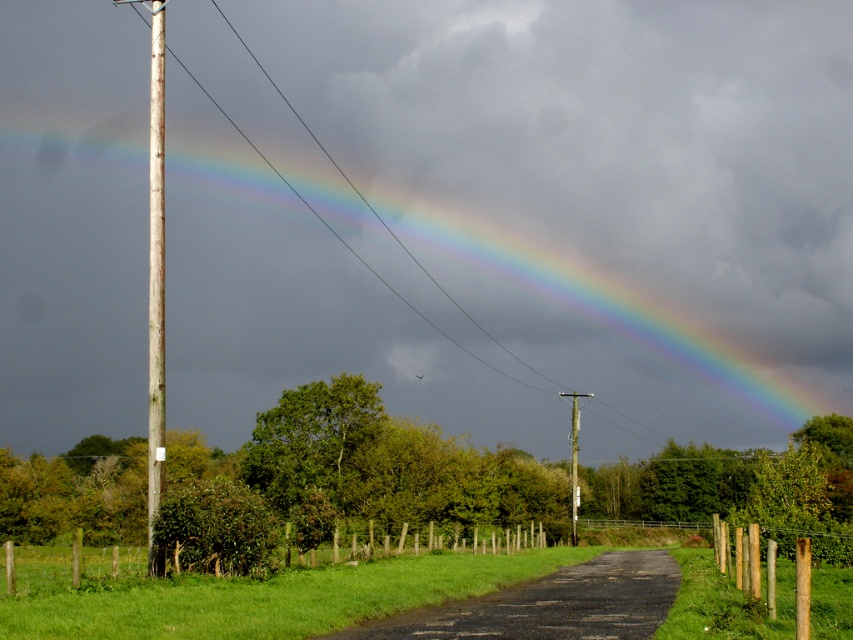
Question: Does weathered wood pole at left appear under wooden utility pole at center?

Choices:
 (A) no
 (B) yes

Answer: (A)

Question: Based on their relative distances, which object is nearer to the rainbow at upper center?

Choices:
 (A) wooden utility pole at center
 (B) weathered wood pole at left

Answer: (A)

Question: Which point appears farthest from the camera in this image?

Choices:
 (A) (625, 582)
 (B) (393, 192)
 (C) (161, 81)
 (D) (575, 444)

Answer: (C)

Question: Is rainbow at upper center to the right of black asphalt road at center from the viewer's perspective?

Choices:
 (A) yes
 (B) no

Answer: (B)

Question: Can you confirm if rainbow at upper center is positioned to the left of black asphalt road at center?

Choices:
 (A) no
 (B) yes

Answer: (B)

Question: Which of these objects is positioned farthest from the wooden utility pole at center?

Choices:
 (A) weathered wood pole at left
 (B) rainbow at upper center
 (C) black asphalt road at center

Answer: (A)